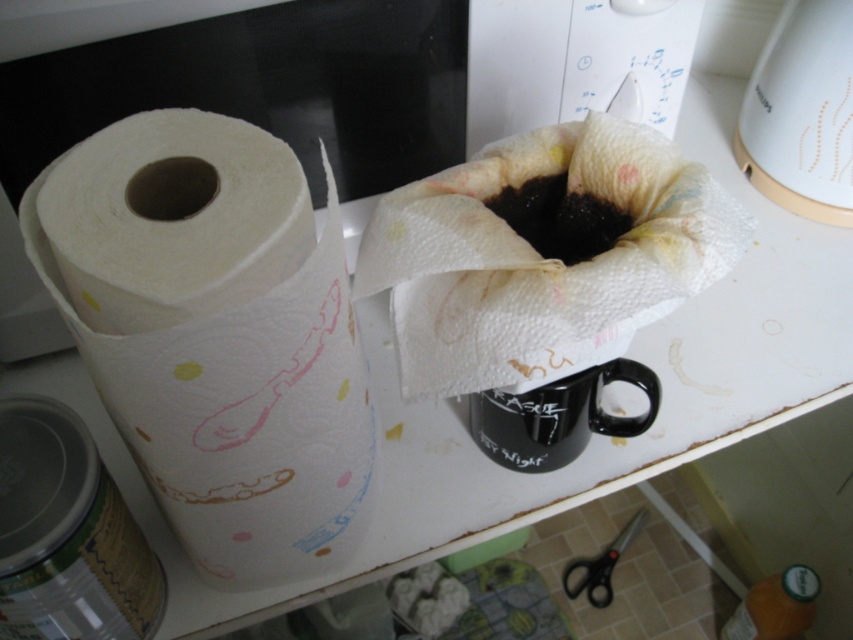
Question: In this image, where is black ceramic mug at center located relative to black matte coffee at center?

Choices:
 (A) left
 (B) right

Answer: (B)

Question: Which object appears farthest from the camera in this image?

Choices:
 (A) white glossy coffee maker at upper right
 (B) black matte coffee at center
 (C) black ceramic mug at center
 (D) white glossy microwave at upper center

Answer: (A)

Question: Based on their relative distances, which object is nearer to the black matte coffee at center?

Choices:
 (A) black ceramic mug at center
 (B) white textured paper towel at center

Answer: (B)

Question: Does black ceramic mug at center come behind black plastic scissors at lower center?

Choices:
 (A) no
 (B) yes

Answer: (A)

Question: Does white glossy microwave at upper center appear under black plastic scissors at lower center?

Choices:
 (A) no
 (B) yes

Answer: (A)

Question: Which object is farther from the camera taking this photo?

Choices:
 (A) white paper towel at left
 (B) black ceramic mug at center
 (C) black matte coffee at center

Answer: (B)